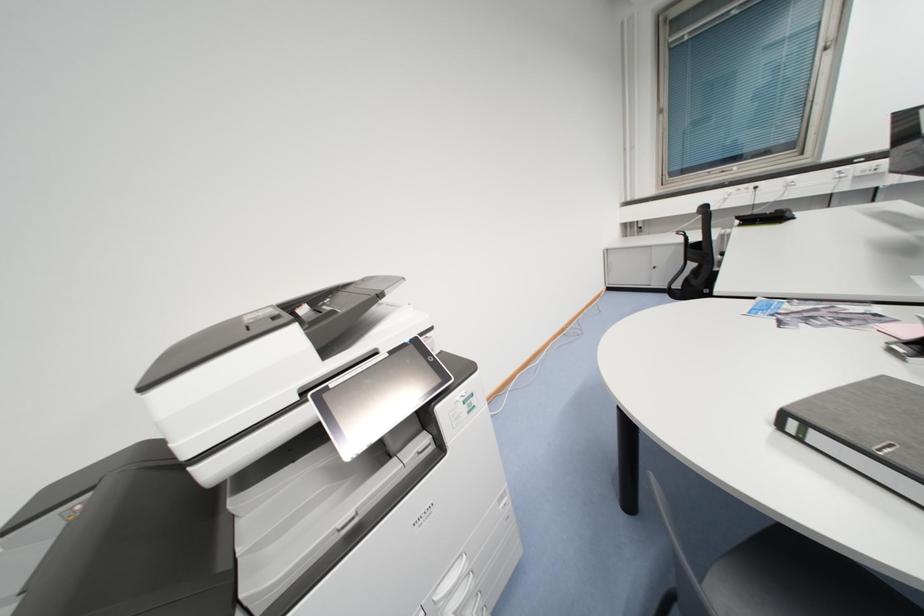
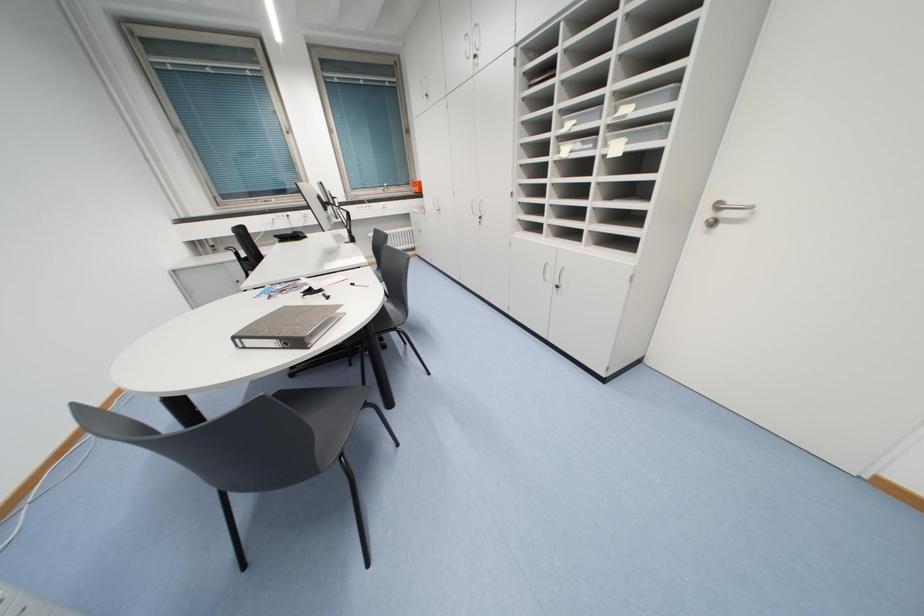
Question: The images are taken continuously from a first-person perspective. In which direction is your viewpoint rotating?

Choices:
 (A) Left
 (B) Right
 (C) Up
 (D) Down

Answer: (B)